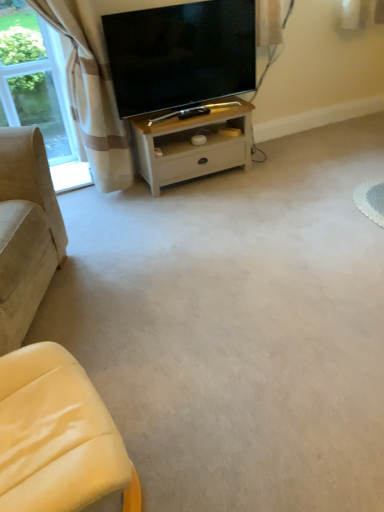
What are the coordinates of `free space that is in between white wood table at center and yellow leather studio couch at lower left, which appears as the second studio couch when viewed from the left` in the screenshot? It's located at (168, 276).